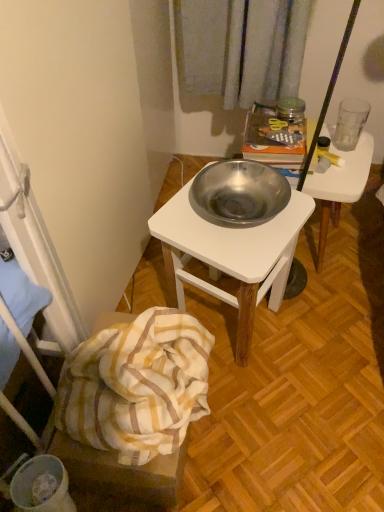
Question: Considering the positions of white striped fabric at lower left and metallic white desk at center, which is the 2th desk from left to right, in the image, is white striped fabric at lower left taller or shorter than metallic white desk at center, which is the 2th desk from left to right,?

Choices:
 (A) tall
 (B) short

Answer: (B)

Question: Is white striped fabric at lower left situated inside metallic white desk at center, which is the 2th desk from left to right, or outside?

Choices:
 (A) inside
 (B) outside

Answer: (B)

Question: Based on their relative distances, which object is nearer to the white striped fabric at lower left?

Choices:
 (A) metallic white desk at center, which is the 2th desk from left to right
 (B) polished stainless steel bowl at center, positioned as the 1th desk in left-to-right order
 (C) transparent glass at upper right

Answer: (B)

Question: Which object is the farthest from the transparent glass at upper right?

Choices:
 (A) white striped fabric at lower left
 (B) polished stainless steel bowl at center, positioned as the 1th desk in left-to-right order
 (C) metallic white desk at center, marked as the first desk in a right-to-left arrangement

Answer: (A)